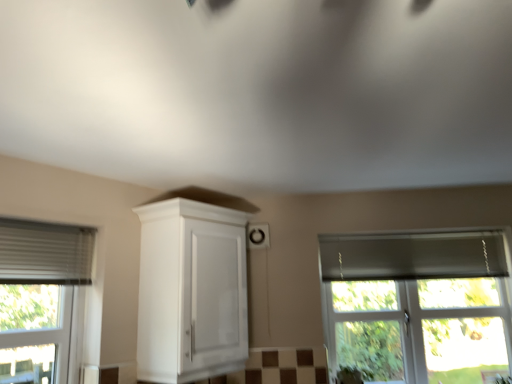
Question: Considering the positions of white glossy cabinet at center and transparent glass window at right in the image, is white glossy cabinet at center taller or shorter than transparent glass window at right?

Choices:
 (A) short
 (B) tall

Answer: (A)

Question: In terms of width, does white glossy cabinet at center look wider or thinner when compared to transparent glass window at right?

Choices:
 (A) thin
 (B) wide

Answer: (B)

Question: From a real-world perspective, is white glossy cabinet at center positioned above or below transparent glass window at right?

Choices:
 (A) below
 (B) above

Answer: (B)

Question: Considering the positions of point (445, 286) and point (197, 322), is point (445, 286) closer or farther from the camera than point (197, 322)?

Choices:
 (A) farther
 (B) closer

Answer: (A)

Question: From a real-world perspective, relative to white glossy cabinet at center, is transparent glass window at right vertically above or below?

Choices:
 (A) above
 (B) below

Answer: (B)

Question: Relative to white glossy cabinet at center, is transparent glass window at right in front or behind?

Choices:
 (A) front
 (B) behind

Answer: (B)

Question: Is transparent glass window at right spatially inside white glossy cabinet at center, or outside of it?

Choices:
 (A) inside
 (B) outside

Answer: (B)